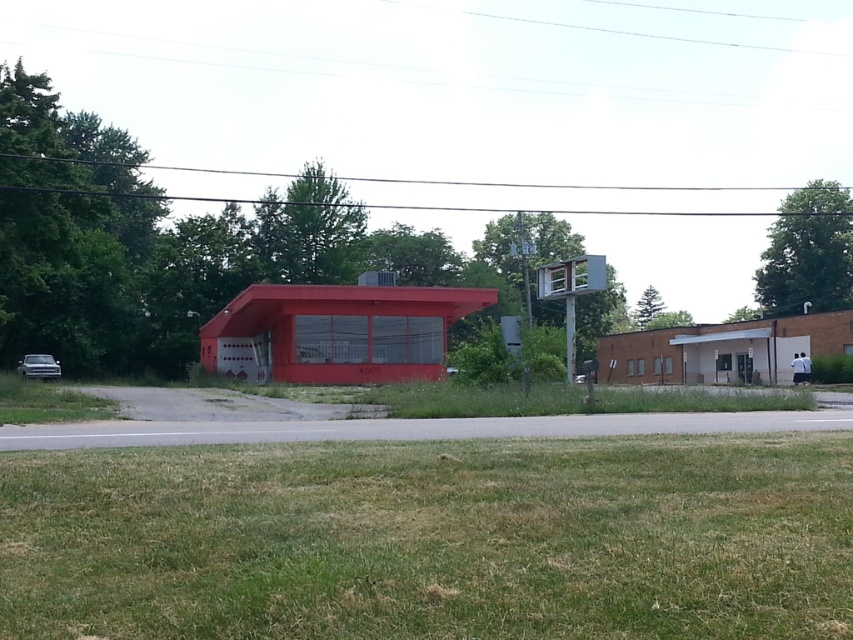
Question: Considering the relative positions of matte red fire station at center and metallic silver car at lower left in the image provided, where is matte red fire station at center located with respect to metallic silver car at lower left?

Choices:
 (A) below
 (B) above

Answer: (B)

Question: Which of the following is the farthest from the observer?

Choices:
 (A) (355, 369)
 (B) (30, 358)

Answer: (B)

Question: Is matte red fire station at center thinner than metallic silver car at lower left?

Choices:
 (A) no
 (B) yes

Answer: (A)

Question: Among these points, which one is nearest to the camera?

Choices:
 (A) (334, 376)
 (B) (19, 369)

Answer: (A)

Question: Where is matte red fire station at center located in relation to metallic silver car at lower left in the image?

Choices:
 (A) below
 (B) above

Answer: (B)